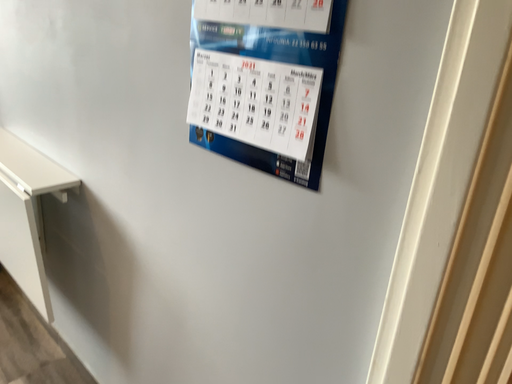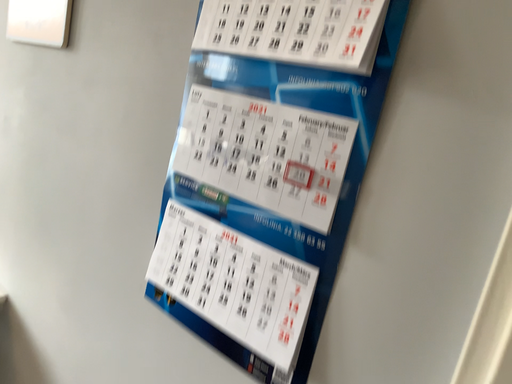
Question: How did the camera likely rotate when shooting the video?

Choices:
 (A) rotated upward
 (B) rotated downward

Answer: (A)